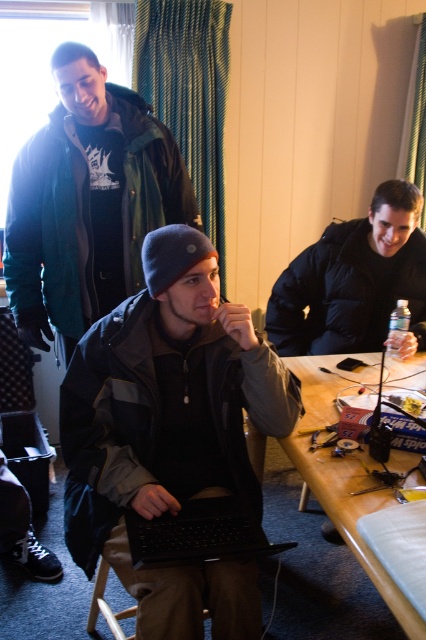
Question: Does black puffy jacket at upper right appear on the left side of black matte laptop at center?

Choices:
 (A) yes
 (B) no

Answer: (B)

Question: Which of the following is the closest to the observer?

Choices:
 (A) (327, 481)
 (B) (368, 244)
 (C) (250, 506)

Answer: (A)

Question: Which is farther from the matte black jacket at upper left?

Choices:
 (A) black puffy jacket at upper right
 (B) black matte laptop at center

Answer: (B)

Question: Is matte black laptop at center below wooden table at center?

Choices:
 (A) no
 (B) yes

Answer: (A)

Question: Is matte black jacket at upper left to the left of black matte laptop at center from the viewer's perspective?

Choices:
 (A) no
 (B) yes

Answer: (B)

Question: Based on their relative distances, which object is nearer to the black puffy jacket at upper right?

Choices:
 (A) wooden table at center
 (B) black matte laptop at center
 (C) matte black laptop at center
 (D) matte black jacket at upper left

Answer: (A)